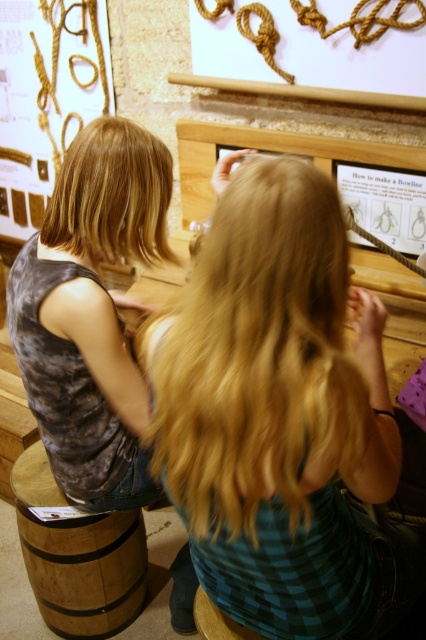
Between blonde smooth hair at upper left and wooden stool at lower center, which one has less height?

With less height is wooden stool at lower center.

Does point (86, 129) come behind point (199, 595)?

That is False.

Locate an element on the screen. blonde smooth hair at upper left is located at coordinates (112, 195).

Identify the location of blonde smooth hair at upper left. (112, 195).

Is blonde hair at center bigger than matte gray tank top at left?

Actually, blonde hair at center might be smaller than matte gray tank top at left.

Does blonde hair at center appear over matte gray tank top at left?

Incorrect, blonde hair at center is not positioned above matte gray tank top at left.

Describe the element at coordinates (264, 356) in the screenshot. I see `blonde hair at center` at that location.

You are a GUI agent. You are given a task and a screenshot of the screen. Output one action in this format:
    pyautogui.click(x=<x>, y=<y>)
    Task: Click on the blonde hair at center
    
    Given the screenshot: What is the action you would take?
    pyautogui.click(x=264, y=356)

Does matte gray tank top at left appear on the right side of wooden barrel at lower left?

Yes, matte gray tank top at left is to the right of wooden barrel at lower left.

The width and height of the screenshot is (426, 640). What are the coordinates of `matte gray tank top at left` in the screenshot? It's located at (92, 312).